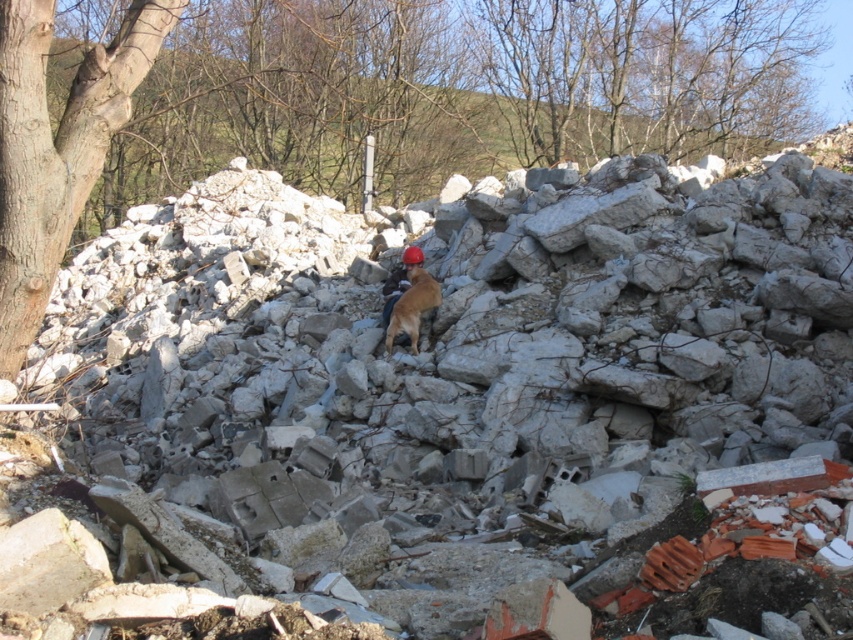
Based on the photo, which is more to the right, brown furry dog at center or matte orange helmet at center?

brown furry dog at center is more to the right.

Between brown furry dog at center and matte orange helmet at center, which one has more height?

brown furry dog at center

Which is in front, point (434, 307) or point (393, 296)?

Point (434, 307)

Where is `brown furry dog at center`? The width and height of the screenshot is (853, 640). brown furry dog at center is located at coordinates (412, 307).

You are a GUI agent. You are given a task and a screenshot of the screen. Output one action in this format:
    pyautogui.click(x=<x>, y=<y>)
    Task: Click on the brown bark tree at upper left
    
    Given the screenshot: What is the action you would take?
    coord(370,99)

Between brown bark tree at upper left and brown furry dog at center, which one has more height?

brown bark tree at upper left is taller.

Identify the location of brown bark tree at upper left. (370, 99).

Does smooth brown tree trunk at left lie in front of brown furry dog at center?

Yes, it is.

Between smooth brown tree trunk at left and brown furry dog at center, which one appears on the right side from the viewer's perspective?

From the viewer's perspective, brown furry dog at center appears more on the right side.

Who is more distant from viewer, (x=0, y=42) or (x=434, y=304)?

Positioned behind is point (x=434, y=304).

Where is `smooth brown tree trunk at left`? The height and width of the screenshot is (640, 853). smooth brown tree trunk at left is located at coordinates (56, 147).